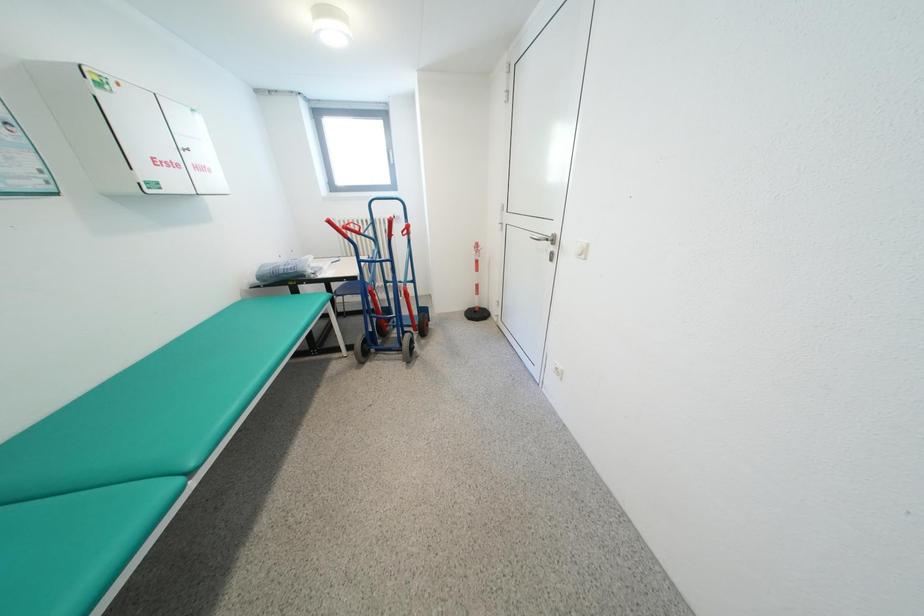
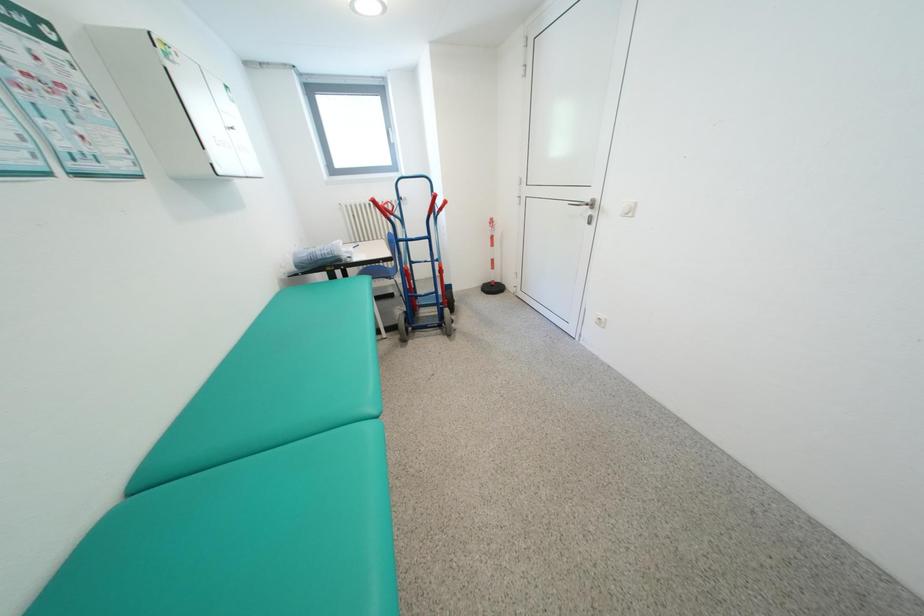
Question: The camera is either moving clockwise (left) or counter-clockwise (right) around the object. The first image is from the beginning of the video and the second image is from the end. Is the camera moving left or right when shooting the video?

Choices:
 (A) Left
 (B) Right

Answer: (A)